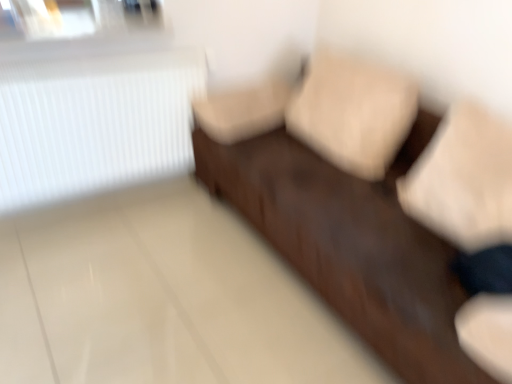
The height and width of the screenshot is (384, 512). What do you see at coordinates (343, 207) in the screenshot? I see `dark brown leather couch at center` at bounding box center [343, 207].

Locate an element on the screen. Image resolution: width=512 pixels, height=384 pixels. dark brown leather couch at center is located at coordinates (343, 207).

Identify the location of white ribbed radiator at upper left. Image resolution: width=512 pixels, height=384 pixels. (94, 122).

Describe the element at coordinates (94, 122) in the screenshot. This screenshot has width=512, height=384. I see `white ribbed radiator at upper left` at that location.

Identify the location of dark brown leather couch at center. (343, 207).

Is white ribbed radiator at upper left to the left or to the right of dark brown leather couch at center in the image?

Based on their positions, white ribbed radiator at upper left is located to the left of dark brown leather couch at center.

Is white ribbed radiator at upper left in front of or behind dark brown leather couch at center in the image?

In the image, white ribbed radiator at upper left appears behind dark brown leather couch at center.

Between point (40, 60) and point (423, 260), which one is positioned in front?

The point (423, 260) is closer.

From the image's perspective, is white ribbed radiator at upper left above dark brown leather couch at center?

Correct, white ribbed radiator at upper left appears higher than dark brown leather couch at center in the image.

From a real-world perspective, is white ribbed radiator at upper left below dark brown leather couch at center?

No, from a real-world perspective, white ribbed radiator at upper left is not under dark brown leather couch at center.

Is white ribbed radiator at upper left wider or thinner than dark brown leather couch at center?

In the image, white ribbed radiator at upper left appears to be more narrow than dark brown leather couch at center.

Who is taller, white ribbed radiator at upper left or dark brown leather couch at center?

dark brown leather couch at center is taller.

Between white ribbed radiator at upper left and dark brown leather couch at center, which one has smaller size?

white ribbed radiator at upper left is smaller.

Is dark brown leather couch at center a part of white ribbed radiator at upper left?

No, white ribbed radiator at upper left does not contain dark brown leather couch at center.

Is white ribbed radiator at upper left far away from dark brown leather couch at center?

Actually, white ribbed radiator at upper left and dark brown leather couch at center are a little close together.

Is white ribbed radiator at upper left turned away from dark brown leather couch at center?

That's not correct — white ribbed radiator at upper left is not looking away from dark brown leather couch at center.

How many degrees apart are the facing directions of white ribbed radiator at upper left and dark brown leather couch at center?

89.7 degrees separate the facing orientations of white ribbed radiator at upper left and dark brown leather couch at center.

Where is `radiator behind the dark brown leather couch at center`? The width and height of the screenshot is (512, 384). radiator behind the dark brown leather couch at center is located at coordinates (94, 122).

Does dark brown leather couch at center appear on the left side of white ribbed radiator at upper left?

In fact, dark brown leather couch at center is to the right of white ribbed radiator at upper left.

Between dark brown leather couch at center and white ribbed radiator at upper left, which one is positioned in front?

dark brown leather couch at center is in front.

Is point (435, 368) closer to viewer compared to point (31, 190)?

That is True.

From the image's perspective, which is below, dark brown leather couch at center or white ribbed radiator at upper left?

dark brown leather couch at center is shown below in the image.

From a real-world perspective, which object rests below the other?

From a 3D spatial view, dark brown leather couch at center is below.

Considering the sizes of objects dark brown leather couch at center and white ribbed radiator at upper left in the image provided, who is wider, dark brown leather couch at center or white ribbed radiator at upper left?

With larger width is dark brown leather couch at center.

Does dark brown leather couch at center have a greater height compared to white ribbed radiator at upper left?

Yes, dark brown leather couch at center is taller than white ribbed radiator at upper left.

Between dark brown leather couch at center and white ribbed radiator at upper left, which one has larger size?

dark brown leather couch at center is bigger.

Choose the correct answer: Is dark brown leather couch at center inside white ribbed radiator at upper left or outside it?

dark brown leather couch at center exists outside the volume of white ribbed radiator at upper left.

Is dark brown leather couch at center beside white ribbed radiator at upper left?

dark brown leather couch at center is not next to white ribbed radiator at upper left, and they're not touching.

Is white ribbed radiator at upper left at the back of dark brown leather couch at center?

dark brown leather couch at center is not turned away from white ribbed radiator at upper left.

How many degrees apart are the facing directions of dark brown leather couch at center and white ribbed radiator at upper left?

89.7 degrees.

Measure the distance between dark brown leather couch at center and white ribbed radiator at upper left.

27.83 inches.

At what (x,y) coordinates should I click in order to perform the action: click on radiator that appears above the dark brown leather couch at center (from a real-world perspective). Please return your answer as a coordinate pair (x, y). This screenshot has width=512, height=384. Looking at the image, I should click on (94, 122).

Find the location of a particular element. radiator that is behind the dark brown leather couch at center is located at coordinates (94, 122).

Locate an element on the screen. The width and height of the screenshot is (512, 384). furniture in front of the white ribbed radiator at upper left is located at coordinates point(343,207).